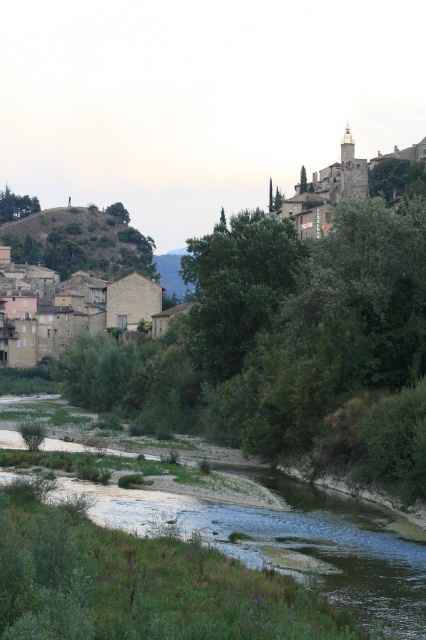
Question: Which of these objects is positioned farthest from the stone tower at upper right?

Choices:
 (A) green grassy stream at lower left
 (B) green leafy tree at upper left
 (C) green leafy tree at upper right
 (D) green leafy tree at center

Answer: (B)

Question: Among these objects, which one is nearest to the camera?

Choices:
 (A) green leafy tree at upper left
 (B) stone tower at upper right
 (C) green leafy tree at upper center
 (D) green leafy tree at center

Answer: (D)

Question: Does green leafy tree at upper left appear on the right side of green leafy tree at upper center?

Choices:
 (A) yes
 (B) no

Answer: (B)

Question: Can you confirm if green grassy hillside at upper left is positioned above green leafy tree at upper center?

Choices:
 (A) no
 (B) yes

Answer: (A)

Question: Does green leafy tree at center appear on the right side of green grassy hillside at upper left?

Choices:
 (A) yes
 (B) no

Answer: (A)

Question: Which point is farther from the camera taking this photo?

Choices:
 (A) (149, 518)
 (B) (301, 176)
 (C) (115, 218)

Answer: (C)